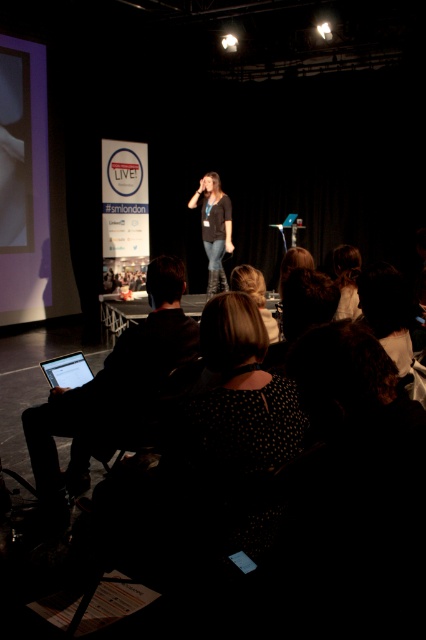
Is point (147, 355) positioned in front of point (212, 259)?

That is True.

Measure the distance between matte black laptop at lower left and dark brown leather jacket at center.

The distance of matte black laptop at lower left from dark brown leather jacket at center is 4.68 meters.

Identify the location of matte black laptop at lower left. (112, 388).

Is dark brown leather jacket at center to the right of blonde hair at center from the viewer's perspective?

No, dark brown leather jacket at center is not to the right of blonde hair at center.

Is the position of dark brown leather jacket at center less distant than that of blonde hair at center?

No, dark brown leather jacket at center is further to the viewer.

Is point (218, 284) positioned before point (256, 291)?

No, (218, 284) is behind (256, 291).

Find the location of a particular element. The width and height of the screenshot is (426, 640). dark brown leather jacket at center is located at coordinates (213, 227).

Is point (221, 218) farther from camera compared to point (333, 259)?

Yes, point (221, 218) is behind point (333, 259).

Which is in front, point (222, 248) or point (353, 266)?

Point (353, 266) is more forward.

The width and height of the screenshot is (426, 640). Find the location of `dark brown leather jacket at center`. dark brown leather jacket at center is located at coordinates (213, 227).